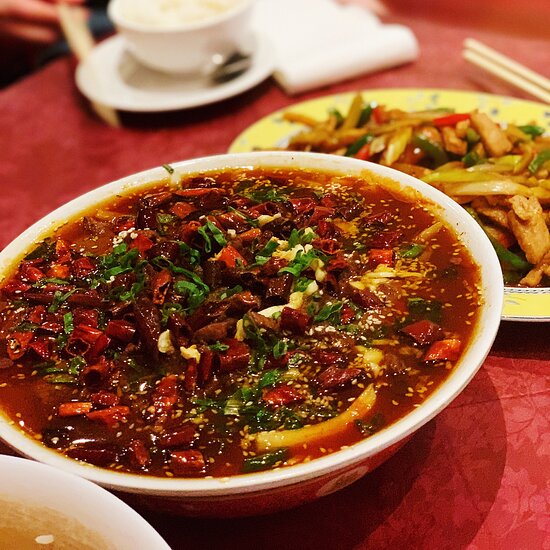
This screenshot has height=550, width=550. In order to click on yellow plate in this screenshot , I will do `click(268, 136)`.